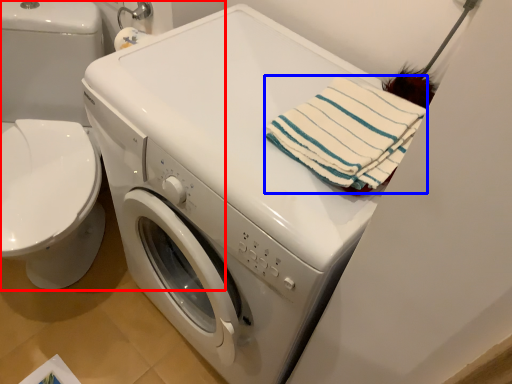
Question: Which of the following is the closest to the observer, washer (highlighted by a red box) or beach towel (highlighted by a blue box)?

Choices:
 (A) washer
 (B) beach towel

Answer: (B)